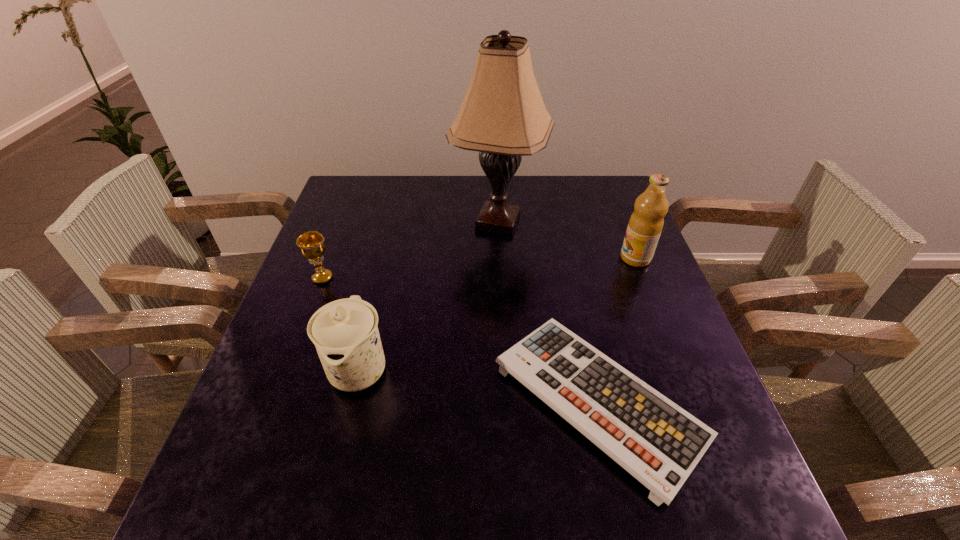
The image size is (960, 540). In order to click on the tallest object in this screenshot , I will do `click(503, 117)`.

Locate an element on the screen. This screenshot has width=960, height=540. the second tallest object is located at coordinates (646, 223).

Locate an element on the screen. The height and width of the screenshot is (540, 960). chinaware is located at coordinates (345, 333).

Find the location of a particular element. The height and width of the screenshot is (540, 960). the third tallest object is located at coordinates (345, 333).

You are a GUI agent. You are given a task and a screenshot of the screen. Output one action in this format:
    pyautogui.click(x=<x>, y=<y>)
    Task: Click on the second shortest object
    This screenshot has height=540, width=960.
    Given the screenshot: What is the action you would take?
    pyautogui.click(x=312, y=246)

The image size is (960, 540). Find the location of `the third nearest object`. the third nearest object is located at coordinates (312, 246).

Where is `computer keyboard`? The image size is (960, 540). computer keyboard is located at coordinates tap(659, 443).

Where is `vacant space positioned on the left of the lamp`? The height and width of the screenshot is (540, 960). vacant space positioned on the left of the lamp is located at coordinates (367, 221).

The height and width of the screenshot is (540, 960). I want to click on vacant space located on the label of the fourth shortest object, so click(x=513, y=258).

Locate an element on the screen. vacant region located on the label of the fourth shortest object is located at coordinates (561, 258).